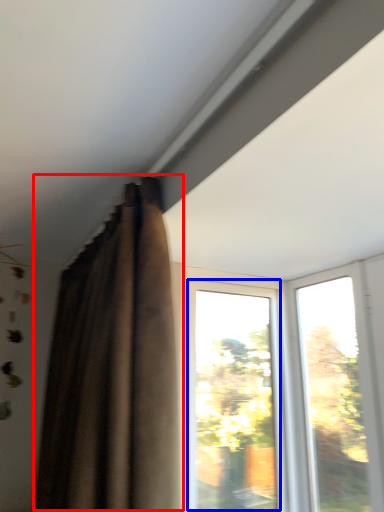
Question: Which object appears closest to the camera in this image, curtain (highlighted by a red box) or window (highlighted by a blue box)?

Choices:
 (A) curtain
 (B) window

Answer: (A)